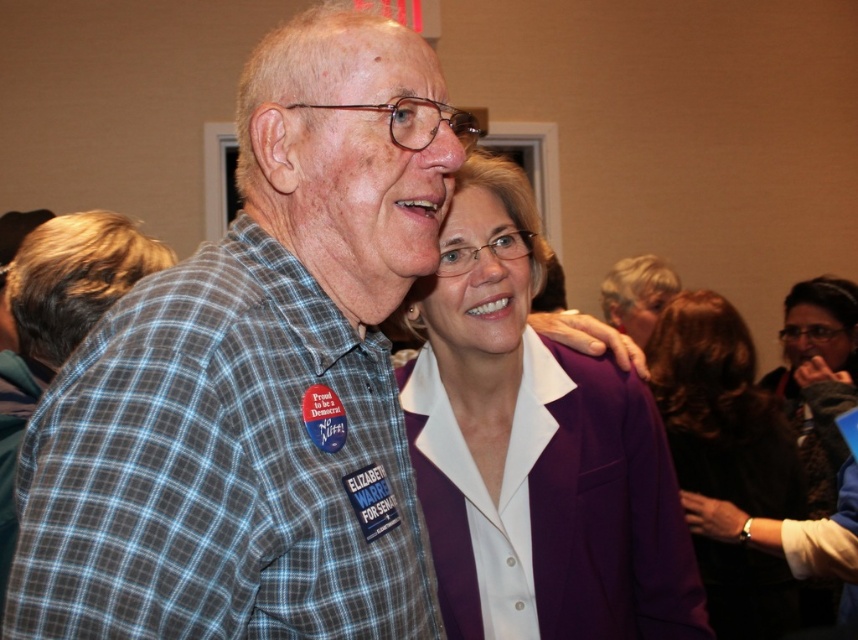
Between purple fabric jacket at center and purple fabric at center, which one appears on the left side from the viewer's perspective?

purple fabric jacket at center

Who is higher up, purple fabric jacket at center or purple fabric at center?

Positioned higher is purple fabric jacket at center.

This screenshot has height=640, width=858. Find the location of `purple fabric jacket at center`. purple fabric jacket at center is located at coordinates (535, 451).

Is plaid shirt at center to the left of purple fabric jacket at center from the viewer's perspective?

Correct, you'll find plaid shirt at center to the left of purple fabric jacket at center.

Which is more to the right, plaid shirt at center or purple fabric jacket at center?

purple fabric jacket at center

Who is more distant from viewer, [258,243] or [524,468]?

Positioned behind is point [524,468].

At what (x,y) coordinates should I click in order to perform the action: click on plaid shirt at center. Please return your answer as a coordinate pair (x, y). Looking at the image, I should click on (257, 380).

Who is shorter, plaid shirt at center or purple fabric at center?

plaid shirt at center is shorter.

The width and height of the screenshot is (858, 640). What are the coordinates of `plaid shirt at center` in the screenshot? It's located at (257, 380).

The height and width of the screenshot is (640, 858). Identify the location of plaid shirt at center. (257, 380).